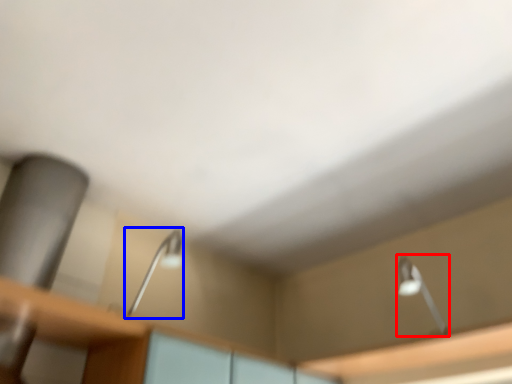
Question: Which of the following is the closest to the observer, lamp (highlighted by a red box) or lamp (highlighted by a blue box)?

Choices:
 (A) lamp
 (B) lamp

Answer: (B)